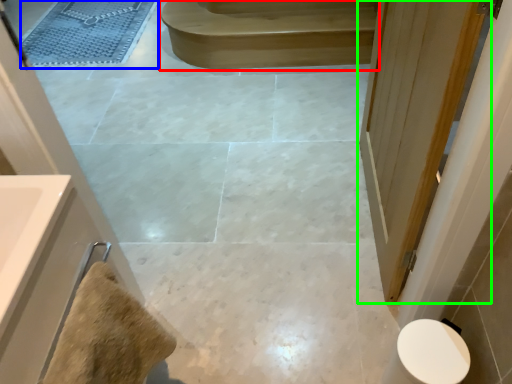
Question: Which object is the farthest from stair (highlighted by a red box)? Choose among these: bath mat (highlighted by a blue box) or door (highlighted by a green box).

Choices:
 (A) bath mat
 (B) door

Answer: (B)